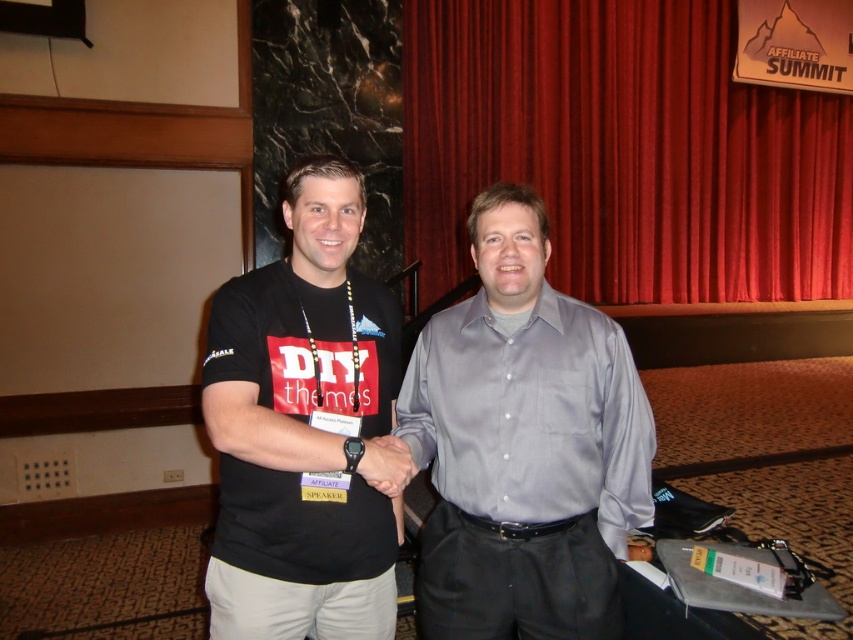
Question: Which object is farther from the camera taking this photo?

Choices:
 (A) red velvet curtain at upper center
 (B) black matte t-shirt at center

Answer: (A)

Question: Can you confirm if gray satin shirt at center is positioned below matte black hand at center?

Choices:
 (A) yes
 (B) no

Answer: (B)

Question: Which object is closer to the camera taking this photo?

Choices:
 (A) black matte t-shirt at center
 (B) matte black hand at center
 (C) gray satin shirt at center

Answer: (A)

Question: Is the position of gray satin shirt at center less distant than that of matte black hand at center?

Choices:
 (A) yes
 (B) no

Answer: (B)

Question: Estimate the real-world distances between objects in this image. Which object is closer to the red velvet curtain at upper center?

Choices:
 (A) black matte t-shirt at center
 (B) matte black hand at center
 (C) gray satin shirt at center

Answer: (C)

Question: In this image, where is red velvet curtain at upper center located relative to matte black hand at center?

Choices:
 (A) above
 (B) below

Answer: (A)